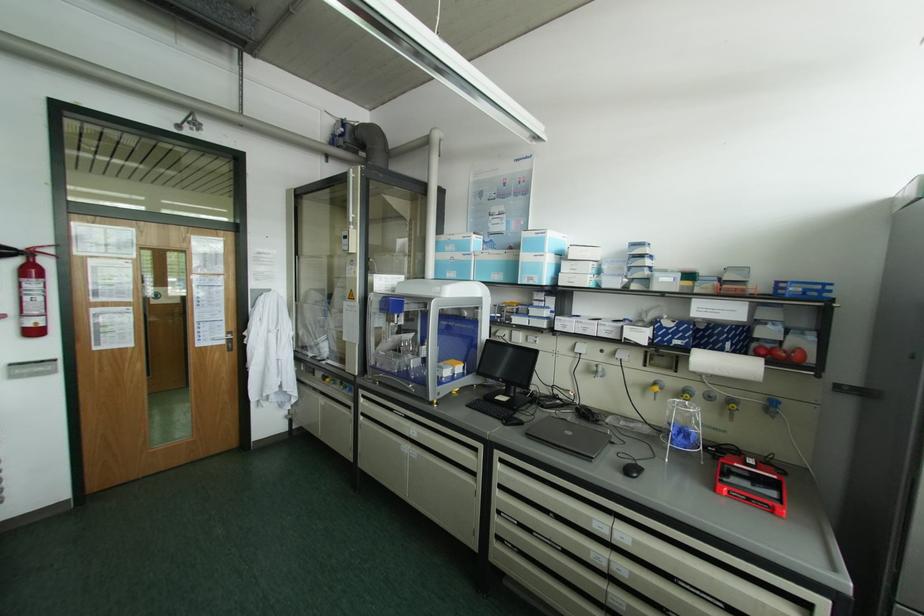
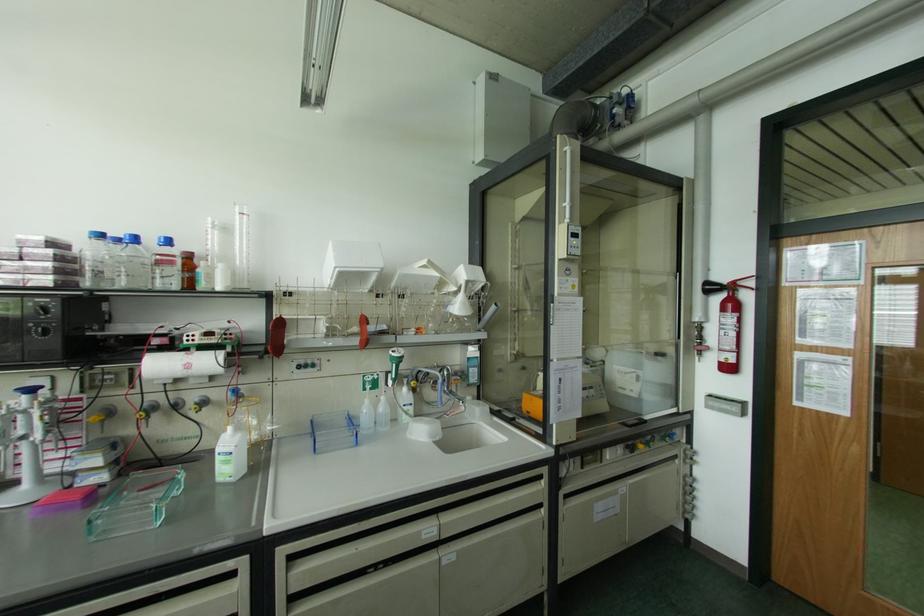
The point at [30,253] is marked in the first image. Where is the corresponding point in the second image?

(732, 286)